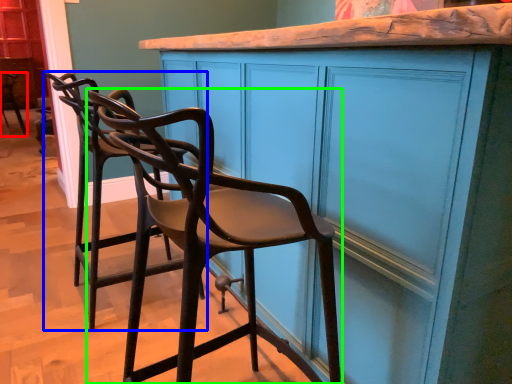
Question: Which is nearer to the chair (highlighted by a red box)? chair (highlighted by a blue box) or chair (highlighted by a green box).

Choices:
 (A) chair
 (B) chair

Answer: (A)